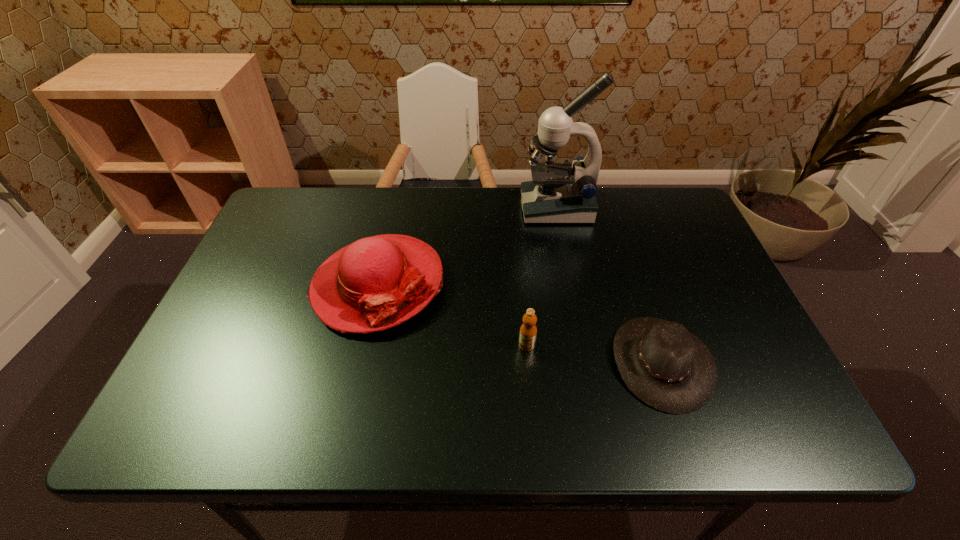
Image resolution: width=960 pixels, height=540 pixels. I want to click on vacant area at the far left corner, so click(324, 196).

In the image, there is a desktop. Where is `vacant space at the near left corner`? The height and width of the screenshot is (540, 960). vacant space at the near left corner is located at coordinates (252, 402).

Locate an element on the screen. The height and width of the screenshot is (540, 960). free space at the far right corner of the desktop is located at coordinates (669, 227).

The image size is (960, 540). Identify the location of vacant area between the left hat and the shortest object. (519, 323).

Image resolution: width=960 pixels, height=540 pixels. I want to click on vacant area that lies between the orange juice and the leftmost object, so click(x=452, y=315).

You are a GUI agent. You are given a task and a screenshot of the screen. Output one action in this format:
    pyautogui.click(x=<x>, y=<y>)
    Task: Click on the empty space between the third object from right to left and the leftmost object
    
    Given the screenshot: What is the action you would take?
    tap(452, 315)

Where is `free space that is in between the shorter hat and the tallest object`? free space that is in between the shorter hat and the tallest object is located at coordinates (609, 285).

I want to click on vacant area that lies between the left hat and the microscope, so click(468, 246).

I want to click on free area in between the shortest object and the leftmost object, so click(x=519, y=323).

I want to click on free spot between the left hat and the shortest object, so click(519, 323).